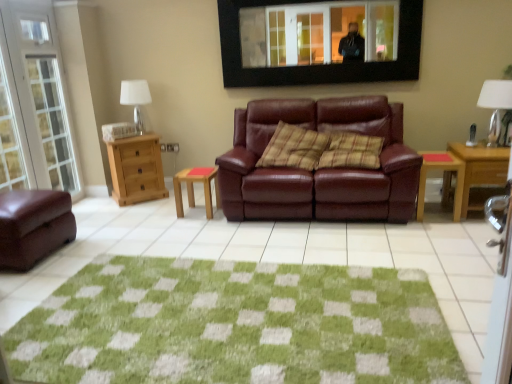
The height and width of the screenshot is (384, 512). Identify the location of free space in front of wooden stool at center, marked as the first table in a left-to-right arrangement. (199, 222).